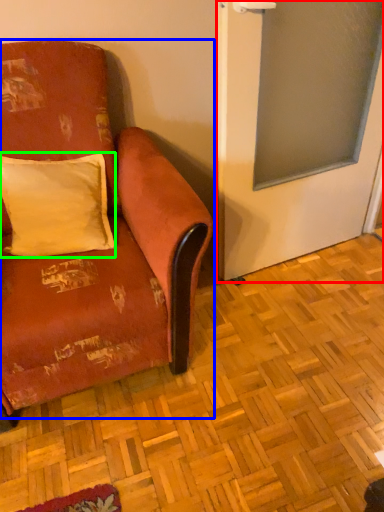
Question: Considering the real-world distances, which object is farthest from screen door (highlighted by a red box)? studio couch (highlighted by a blue box) or pillow (highlighted by a green box)?

Choices:
 (A) studio couch
 (B) pillow

Answer: (B)